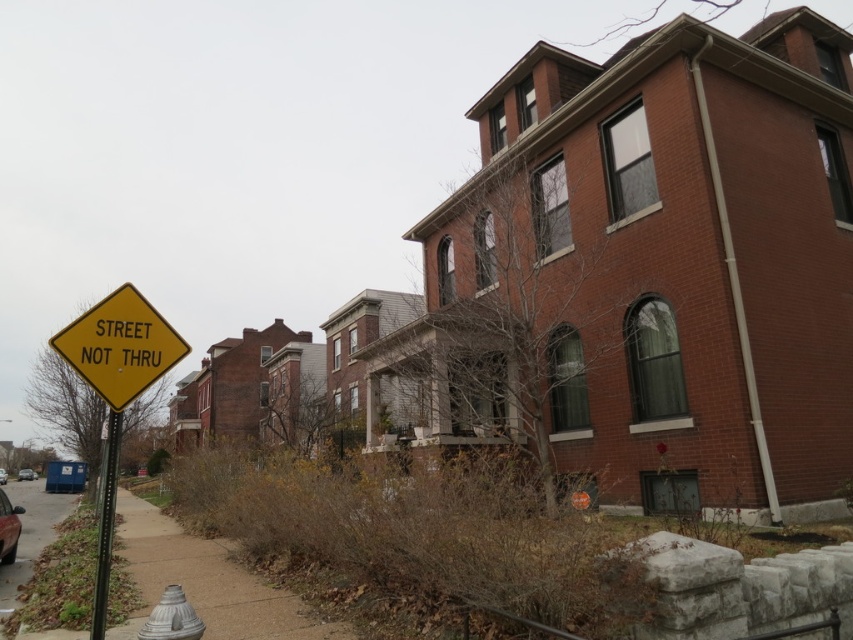
Which is behind, point (15, 557) or point (3, 477)?

The point (3, 477) is behind.

Can you confirm if concrete sidewalk at lower left is positioned to the right of metallic silver car at lower left?

Correct, you'll find concrete sidewalk at lower left to the right of metallic silver car at lower left.

Who is more forward, (15, 563) or (0, 477)?

Point (15, 563) is more forward.

Locate an element on the screen. This screenshot has height=640, width=853. concrete sidewalk at lower left is located at coordinates (30, 534).

Is the position of black metal pole at left more distant than that of matte black car at lower left?

No, black metal pole at left is closer to the viewer.

Between point (102, 612) and point (24, 468), which one is positioned in front?

Point (102, 612) is more forward.

This screenshot has width=853, height=640. I want to click on black metal pole at left, so click(x=105, y=524).

Does shiny black car at lower left appear on the right side of matte black car at lower left?

Correct, you'll find shiny black car at lower left to the right of matte black car at lower left.

What do you see at coordinates (9, 529) in the screenshot? I see `shiny black car at lower left` at bounding box center [9, 529].

Which is behind, point (0, 493) or point (25, 468)?

The point (25, 468) is behind.

You are a GUI agent. You are given a task and a screenshot of the screen. Output one action in this format:
    pyautogui.click(x=<x>, y=<y>)
    Task: Click on the shiny black car at lower left
    The image size is (853, 640).
    Given the screenshot: What is the action you would take?
    pyautogui.click(x=9, y=529)